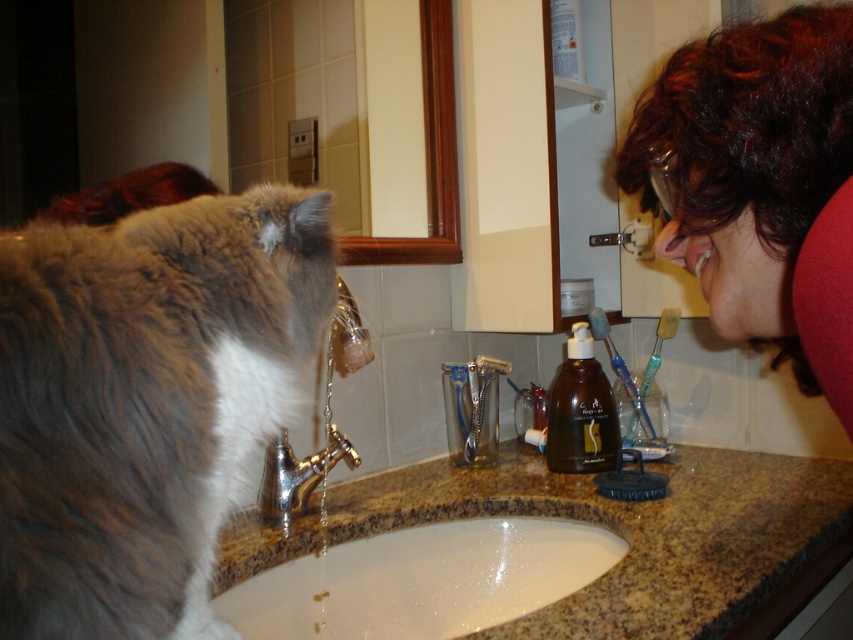
Question: Which point is closer to the camera taking this photo?

Choices:
 (A) (401, 508)
 (B) (538, 557)
 (C) (733, 339)

Answer: (C)

Question: Which point is closer to the camera?

Choices:
 (A) (10, 280)
 (B) (561, 440)

Answer: (A)

Question: Does granite countertop at sink appear on the left side of brown matte bottle at center?

Choices:
 (A) yes
 (B) no

Answer: (A)

Question: Observing the image, what is the correct spatial positioning of granite countertop at sink in reference to white marble sink at center?

Choices:
 (A) left
 (B) right

Answer: (B)

Question: Can you confirm if fluffy gray cat at left is positioned below matte red hair at upper right?

Choices:
 (A) yes
 (B) no

Answer: (A)

Question: Among these points, which one is nearest to the camera?

Choices:
 (A) (102, 541)
 (B) (674, 198)
 (C) (415, 602)

Answer: (A)